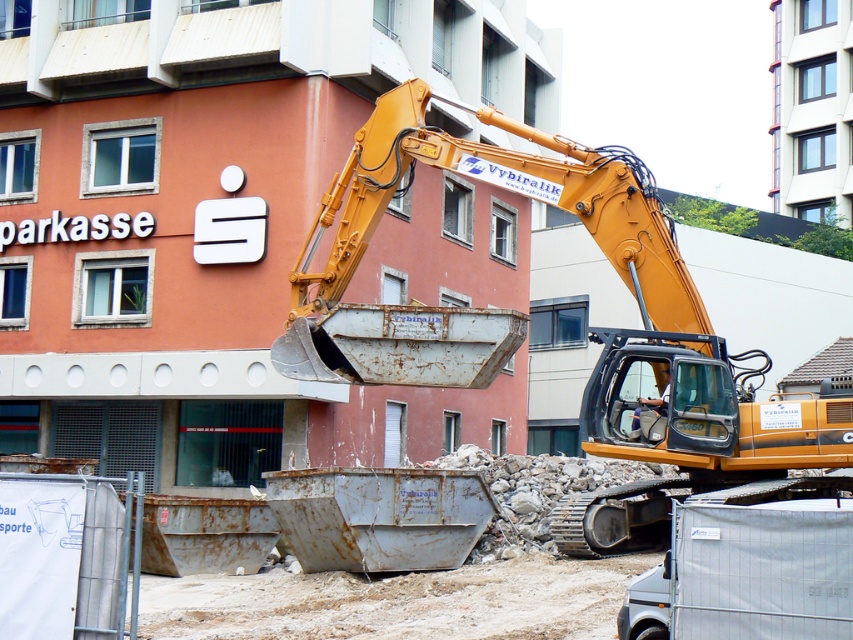
You are standing at the construction site and want to place a new safety sign between the two points, point (819, 448) and point (637, 408). Which point is closer to you so the sign can be placed there?

Point (819, 448) is closer to the viewer than point (637, 408), so the safety sign should be placed there.

You are a construction worker standing at the point with coordinates 0.3, 0.3. You need to move to the yellow metallic excavator at center. Which direction should you move to reach it?

The yellow metallic excavator at center is located at coordinates (525,321). Since your current position is at (254,192), you should move northeast to reach it.

Looking at this image, you are a safety inspector at the construction site. You notice the yellow metallic excavator at center and the light brown leather helmet at center. According to safety regulations, heavy machinery must not be placed over safety equipment. Is the current arrangement compliant with the safety rule?

The yellow metallic excavator at center is positioned over the light brown leather helmet at center, which violates the safety regulation requiring heavy machinery to not be placed over safety equipment. The arrangement is noncompliant.